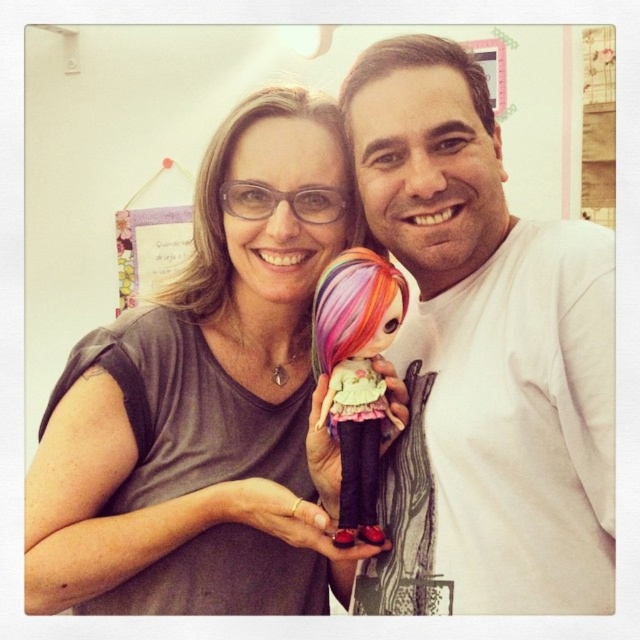
You are standing in front of the image and want to know which of the two points, point [68,600] or point [362,436], is nearer to you. Based on the scene description, which point is closer?

Point [68,600] is closer to the viewer than point [362,436].

You are a photographer trying to focus on the white matte shirt at center and the brown matte hair at upper center. Which object should you adjust your camera focus on first if you want to ensure both are in focus, considering their sizes?

The white matte shirt at center is larger in size than the brown matte hair at upper center, so you should focus on the white matte shirt at center first to ensure both are in focus.